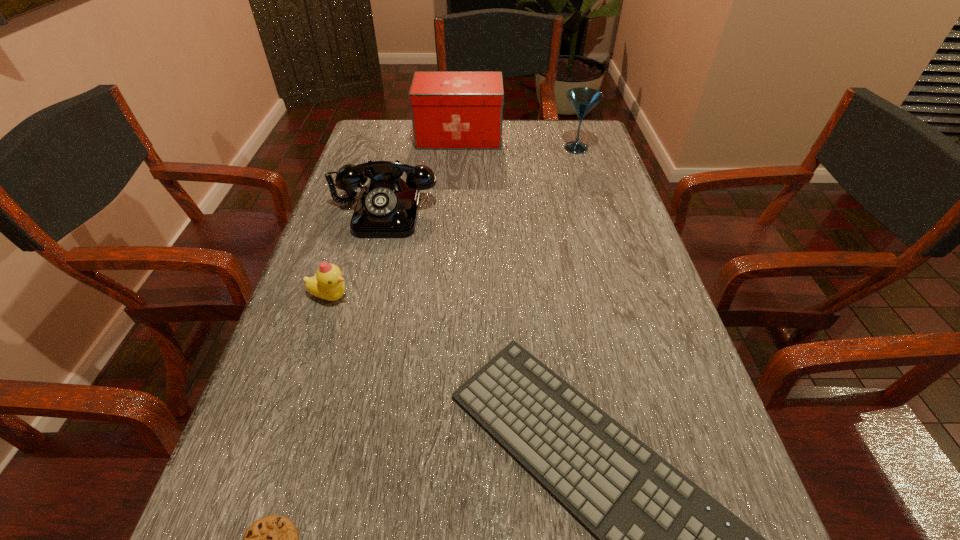
In the image, there is a desktop. Identify the location of vacant space at the far right corner. The width and height of the screenshot is (960, 540). (564, 136).

The height and width of the screenshot is (540, 960). Find the location of `vacant area that lies between the martini and the third shortest object`. vacant area that lies between the martini and the third shortest object is located at coordinates (453, 222).

Where is `free space between the third farthest object and the duckling`? This screenshot has width=960, height=540. free space between the third farthest object and the duckling is located at coordinates pos(357,254).

Locate an element on the screen. free spot between the third nearest object and the telephone is located at coordinates (357, 254).

Select which object appears as the third closest to the first-aid kit. Please provide its 2D coordinates. Your answer should be formatted as a tuple, i.e. [(x, y)], where the tuple contains the x and y coordinates of a point satisfying the conditions above.

[(327, 284)]

The width and height of the screenshot is (960, 540). What are the coordinates of `the closest object to the fourth tallest object` in the screenshot? It's located at (387, 207).

The image size is (960, 540). I want to click on free region that satisfies the following two spatial constraints: 1. on the handle side of the martini; 2. on the left side of the first-aid kit, so click(458, 148).